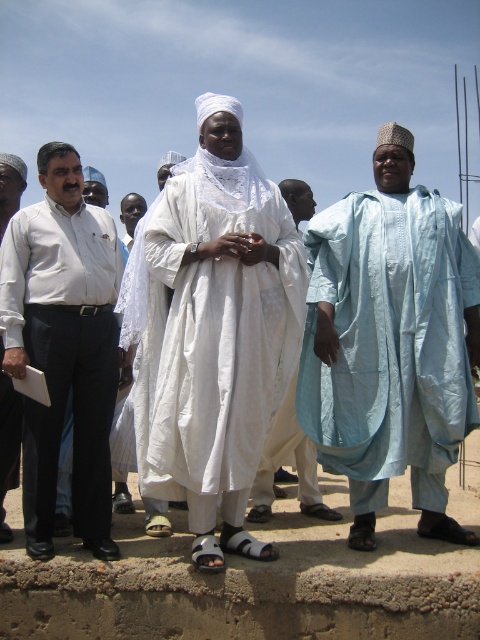
You are taking a photo of the scene and want to focus on both point (x=118, y=548) and point (x=336, y=518). Which point should you adjust your focus first to ensure both are in sharp view?

Point (x=118, y=548) is closer to the camera than point (x=336, y=518). To ensure both are in focus, adjust the focus starting from the closer point (x=118, y=548) first.

What are the coordinates of the light blue fabric at center?

The light blue fabric at center is located at coordinates point (391,340).

You are a photographer positioned at the center of the scene. You want to take a photo of the white shirt at left. Which direction should you move to get the best shot?

The white shirt at left is located at point 0.542 on the x axis and 0.133 on the y axis. Since you are at the center, you should move to the left and slightly downward to align with the subject.